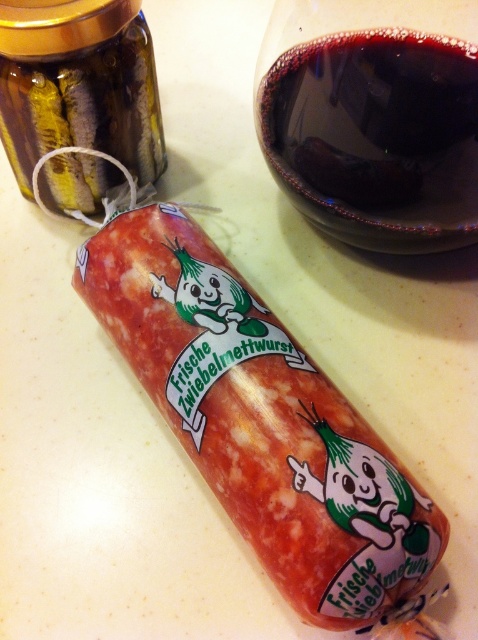
Based on the photo, you are organizing a pantry and need to know which container takes up more space. Which is bigger between the dark red glass at upper right and the translucent amber glass jar at upper left?

The dark red glass at upper right is larger in size than the translucent amber glass jar at upper left, so it takes up more space.

You are a quality inspector checking the packaging of the Frische Zwiebelmettwurst. The packaging must have a specific point for quality control. What is the object located at point (261, 422)?

The point (261, 422) corresponds to the matte pinkish red sausage at center, which is the main product being inspected.